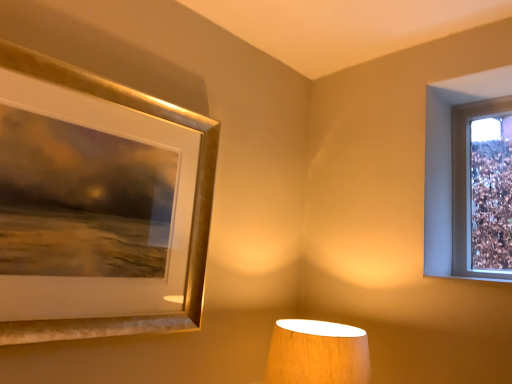
Question: From a real-world perspective, is gold metallic picture frame at upper left physically located above or below wooden lampshade at lower center?

Choices:
 (A) below
 (B) above

Answer: (B)

Question: Relative to wooden lampshade at lower center, is gold metallic picture frame at upper left in front or behind?

Choices:
 (A) front
 (B) behind

Answer: (A)

Question: Does point (91, 319) appear closer or farther from the camera than point (278, 360)?

Choices:
 (A) farther
 (B) closer

Answer: (B)

Question: Looking at the image, does wooden lampshade at lower center seem bigger or smaller compared to gold metallic picture frame at upper left?

Choices:
 (A) big
 (B) small

Answer: (B)

Question: In terms of height, does wooden lampshade at lower center look taller or shorter compared to gold metallic picture frame at upper left?

Choices:
 (A) short
 (B) tall

Answer: (A)

Question: From a real-world perspective, is wooden lampshade at lower center positioned above or below gold metallic picture frame at upper left?

Choices:
 (A) above
 (B) below

Answer: (B)

Question: Is wooden lampshade at lower center in front of or behind gold metallic picture frame at upper left in the image?

Choices:
 (A) behind
 (B) front

Answer: (A)